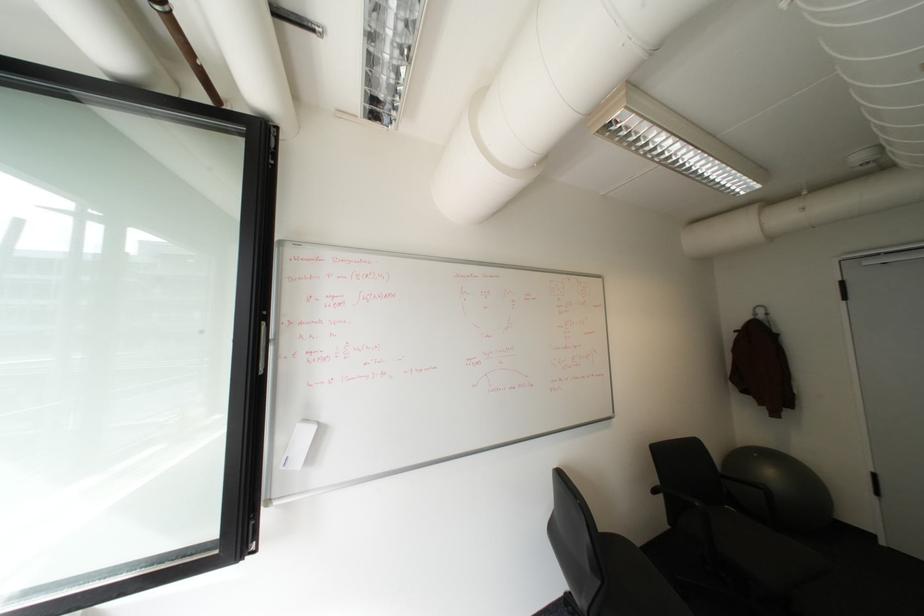
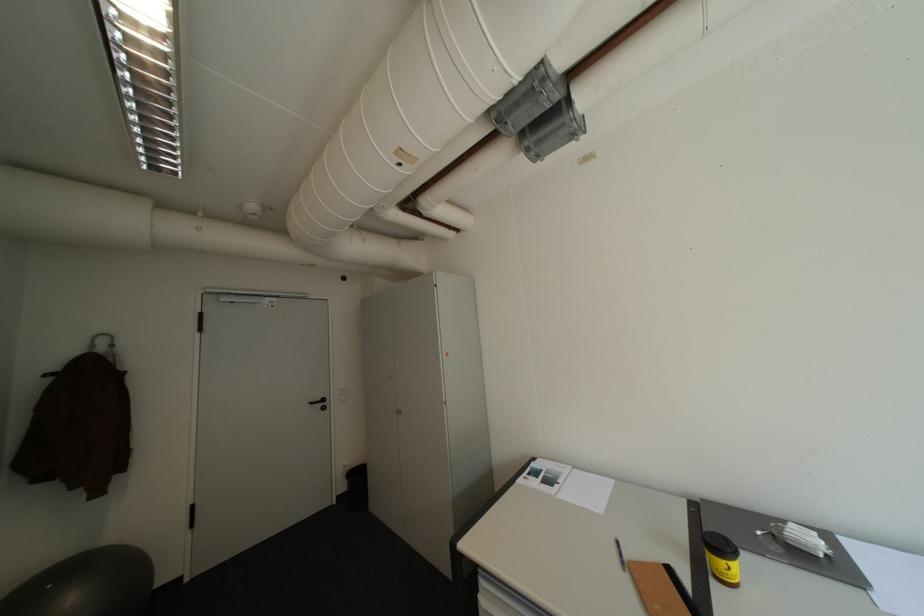
Where in the second image is the point corresponding to [770,312] from the first image?

(113, 342)